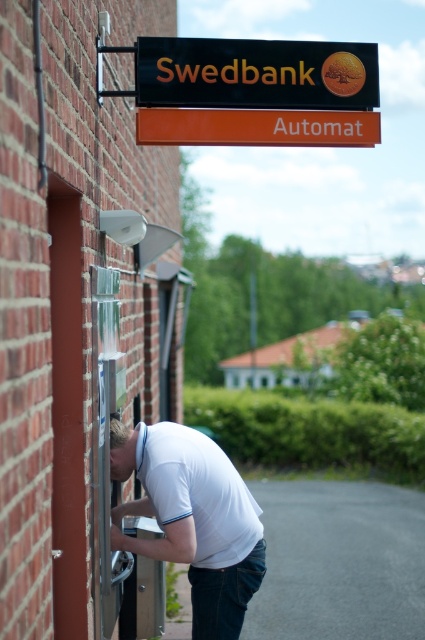
Question: Can you confirm if white matte shirt at center is positioned below black plastic sign at upper center?

Choices:
 (A) yes
 (B) no

Answer: (A)

Question: Can you confirm if white matte shirt at center is wider than black plastic sign at upper center?

Choices:
 (A) no
 (B) yes

Answer: (A)

Question: Which point appears closest to the camera in this image?

Choices:
 (A) (252, 80)
 (B) (192, 134)
 (C) (226, 563)

Answer: (C)

Question: Does black plastic sign at upper center come behind orange plastic sign at upper center?

Choices:
 (A) no
 (B) yes

Answer: (B)

Question: Which object is the closest to the white matte shirt at center?

Choices:
 (A) orange plastic sign at upper center
 (B) black plastic sign at upper center

Answer: (A)

Question: Which object is farther from the camera taking this photo?

Choices:
 (A) black plastic sign at upper center
 (B) orange plastic sign at upper center
 (C) white matte shirt at center

Answer: (A)